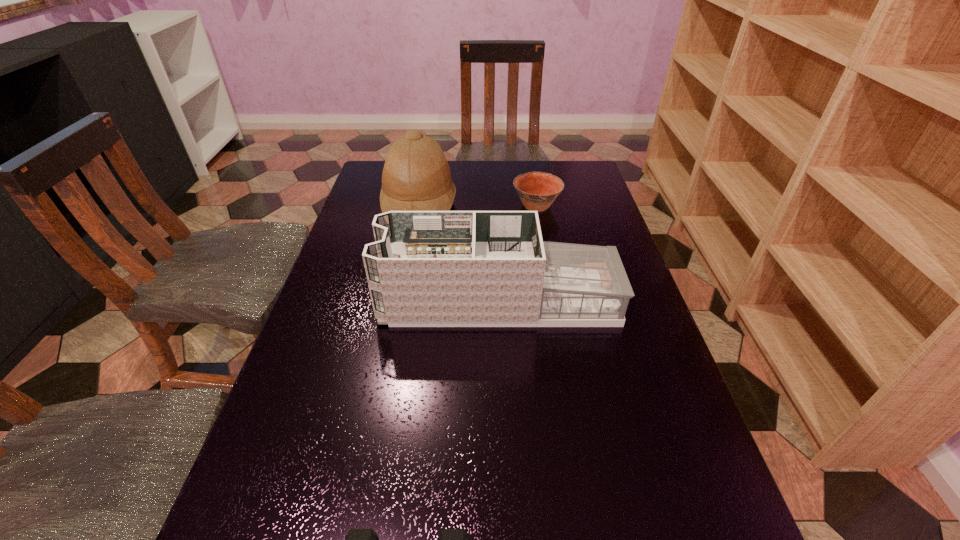
This screenshot has width=960, height=540. What are the coordinates of `bowl that is at the far edge` in the screenshot? It's located at (537, 190).

The width and height of the screenshot is (960, 540). What are the coordinates of `hat that is at the left edge` in the screenshot? It's located at (416, 176).

This screenshot has width=960, height=540. I want to click on dollhouse located in the left edge section of the desktop, so click(426, 268).

Locate an element on the screen. This screenshot has height=540, width=960. dollhouse at the right edge is located at coordinates (426, 268).

Identify the location of bowl that is at the right edge. (537, 190).

Where is `object located in the far left corner section of the desktop`? object located in the far left corner section of the desktop is located at coordinates (416, 176).

What are the coordinates of `object at the far right corner` in the screenshot? It's located at (537, 190).

At what (x,y) coordinates should I click in order to perform the action: click on vacant region at the right edge of the desktop. Please return your answer as a coordinate pair (x, y). This screenshot has height=540, width=960. Looking at the image, I should click on (x=593, y=347).

This screenshot has height=540, width=960. Find the location of `vacant area at the far left corner of the desktop`. vacant area at the far left corner of the desktop is located at coordinates (367, 190).

This screenshot has width=960, height=540. What are the coordinates of `free space between the tallest object and the bowl` in the screenshot? It's located at (478, 206).